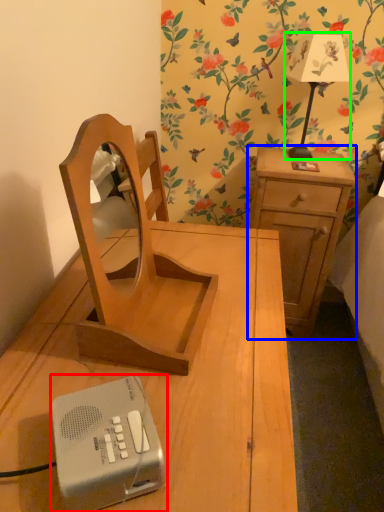
Question: Which object is the closest to the gadget (highlighted by a red box)? Choose among these: nightstand (highlighted by a blue box) or bedside lamp (highlighted by a green box).

Choices:
 (A) nightstand
 (B) bedside lamp

Answer: (A)